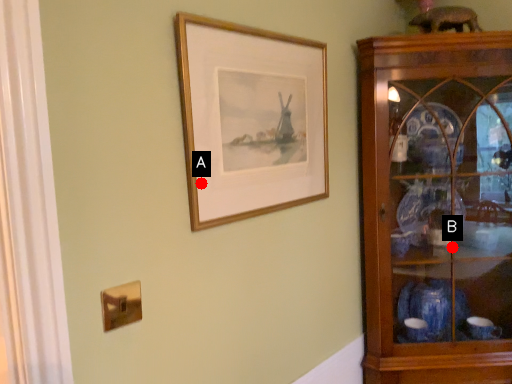
Question: Two points are circled on the image, labeled by A and B beside each circle. Which point is closer to the camera?

Choices:
 (A) A is closer
 (B) B is closer

Answer: (A)